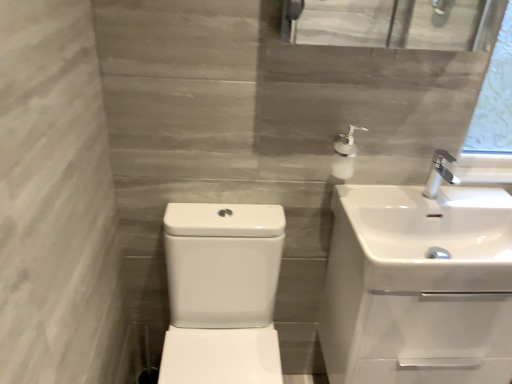
How much space does white glossy sink at right, which is counted as the second sink, starting from the left, occupy vertically?

20.98 inches.

You are a GUI agent. You are given a task and a screenshot of the screen. Output one action in this format:
    pyautogui.click(x=<x>, y=<y>)
    Task: Click on the white glossy sink at upper right, which ranks as the 3th sink in left-to-right order
    The width and height of the screenshot is (512, 384).
    Given the screenshot: What is the action you would take?
    pyautogui.click(x=430, y=221)

From the image's perspective, would you say white glossy soap dispenser at upper right is shown under white glossy sink at right, which is counted as the second sink, starting from the left?

No, from the image's perspective, white glossy soap dispenser at upper right is not beneath white glossy sink at right, which is counted as the second sink, starting from the left.

Does white glossy soap dispenser at upper right have a larger size compared to white glossy sink at right, which is counted as the second sink, starting from the left?

Actually, white glossy soap dispenser at upper right might be smaller than white glossy sink at right, which is counted as the second sink, starting from the left.

Is the position of white glossy soap dispenser at upper right less distant than that of white glossy sink at right, the second sink positioned from the right?

No, white glossy soap dispenser at upper right is behind white glossy sink at right, the second sink positioned from the right.

Is white glossy soap dispenser at upper right thinner than white glossy sink at right, which is counted as the second sink, starting from the left?

Indeed, white glossy soap dispenser at upper right has a lesser width compared to white glossy sink at right, which is counted as the second sink, starting from the left.

Considering the relative positions of white glossy sink at upper right, which is the 1th sink in right-to-left order, and white glossy sink at center, which is the third sink from right to left, in the image provided, is white glossy sink at upper right, which is the 1th sink in right-to-left order, to the right of white glossy sink at center, which is the third sink from right to left, from the viewer's perspective?

Correct, you'll find white glossy sink at upper right, which is the 1th sink in right-to-left order, to the right of white glossy sink at center, which is the third sink from right to left.

Can you tell me how much white glossy sink at upper right, which is the 1th sink in right-to-left order, and white glossy sink at center, which is counted as the first sink, starting from the left, differ in facing direction?

The facing directions of white glossy sink at upper right, which is the 1th sink in right-to-left order, and white glossy sink at center, which is counted as the first sink, starting from the left, are 0.44 degrees apart.

Considering the positions of points (399, 235) and (206, 371), is point (399, 235) closer to camera compared to point (206, 371)?

No, (399, 235) is further to viewer.

Is white glossy sink at upper right, which is the 1th sink in right-to-left order, looking in the opposite direction of white glossy sink at center, which is counted as the first sink, starting from the left?

No, white glossy sink at upper right, which is the 1th sink in right-to-left order, is not facing away from white glossy sink at center, which is counted as the first sink, starting from the left.

Is point (418, 217) farther from camera compared to point (336, 143)?

Yes, it is.

Would you say white glossy sink at right, which is counted as the second sink, starting from the left, is to the left or to the right of white glossy soap dispenser at upper right in the picture?

Clearly, white glossy sink at right, which is counted as the second sink, starting from the left, is on the right of white glossy soap dispenser at upper right in the image.

Considering the relative sizes of white glossy sink at right, which is counted as the second sink, starting from the left, and white glossy soap dispenser at upper right in the image provided, is white glossy sink at right, which is counted as the second sink, starting from the left, shorter than white glossy soap dispenser at upper right?

No.

You are a GUI agent. You are given a task and a screenshot of the screen. Output one action in this format:
    pyautogui.click(x=<x>, y=<y>)
    Task: Click on the sink that is the 1st one when counting forward from the white glossy soap dispenser at upper right
    
    Given the screenshot: What is the action you would take?
    pyautogui.click(x=419, y=283)

Based on the photo, which is closer, (352, 152) or (385, 215)?

Positioned in front is point (385, 215).

Is white glossy soap dispenser at upper right far from white glossy sink at upper right, which is the 1th sink in right-to-left order?

No, there isn't a large distance between white glossy soap dispenser at upper right and white glossy sink at upper right, which is the 1th sink in right-to-left order.

Based on the photo, from a real-world perspective, who is located lower, white glossy soap dispenser at upper right or white glossy sink at upper right, which is the 1th sink in right-to-left order?

white glossy sink at upper right, which is the 1th sink in right-to-left order, from a real-world perspective.

Is white glossy soap dispenser at upper right oriented towards white glossy sink at upper right, which ranks as the 3th sink in left-to-right order?

No, white glossy soap dispenser at upper right is not facing towards white glossy sink at upper right, which ranks as the 3th sink in left-to-right order.

Does point (186, 311) appear closer or farther from the camera than point (350, 149)?

Point (186, 311) is farther from the camera than point (350, 149).

Looking at this image, considering the relative sizes of white glossy sink at center, which is the third sink from right to left, and white glossy soap dispenser at upper right in the image provided, is white glossy sink at center, which is the third sink from right to left, shorter than white glossy soap dispenser at upper right?

No.

Is white glossy sink at center, which is the third sink from right to left, oriented towards white glossy soap dispenser at upper right?

No, white glossy sink at center, which is the third sink from right to left, does not turn towards white glossy soap dispenser at upper right.

Is white glossy sink at center, which is the third sink from right to left, next to white glossy soap dispenser at upper right and touching it?

There is a gap between white glossy sink at center, which is the third sink from right to left, and white glossy soap dispenser at upper right.

Consider the image. Would you say white glossy soap dispenser at upper right is to the left or to the right of white glossy sink at center, which is counted as the first sink, starting from the left, in the picture?

Clearly, white glossy soap dispenser at upper right is on the right of white glossy sink at center, which is counted as the first sink, starting from the left, in the image.

Is white glossy soap dispenser at upper right bigger than white glossy sink at center, which is the third sink from right to left?

Actually, white glossy soap dispenser at upper right might be smaller than white glossy sink at center, which is the third sink from right to left.

From the image's perspective, which one is positioned higher, white glossy soap dispenser at upper right or white glossy sink at center, which is the third sink from right to left?

white glossy soap dispenser at upper right is shown above in the image.

Could white glossy sink at center, which is counted as the first sink, starting from the left, be considered to be inside white glossy soap dispenser at upper right?

Definitely not — white glossy sink at center, which is counted as the first sink, starting from the left, is not inside white glossy soap dispenser at upper right.

Consider the image. Are white glossy sink at upper right, which ranks as the 3th sink in left-to-right order, and white glossy soap dispenser at upper right far apart?

No.

How distant is white glossy sink at upper right, which ranks as the 3th sink in left-to-right order, from white glossy soap dispenser at upper right?

white glossy sink at upper right, which ranks as the 3th sink in left-to-right order, is 10.52 inches from white glossy soap dispenser at upper right.

Who is bigger, white glossy sink at upper right, which ranks as the 3th sink in left-to-right order, or white glossy soap dispenser at upper right?

With larger size is white glossy sink at upper right, which ranks as the 3th sink in left-to-right order.

How many degrees apart are the facing directions of white glossy sink at upper right, which ranks as the 3th sink in left-to-right order, and white glossy soap dispenser at upper right?

white glossy sink at upper right, which ranks as the 3th sink in left-to-right order, and white glossy soap dispenser at upper right are facing 0.247 degrees away from each other.

You are a GUI agent. You are given a task and a screenshot of the screen. Output one action in this format:
    pyautogui.click(x=<x>, y=<y>)
    Task: Click on the soap dispenser to the left of white glossy sink at right, the second sink positioned from the right
    
    Given the screenshot: What is the action you would take?
    pyautogui.click(x=345, y=154)

This screenshot has width=512, height=384. Find the location of `the 2nd sink counting from the right side of the white glossy sink at center, which is the third sink from right to left`. the 2nd sink counting from the right side of the white glossy sink at center, which is the third sink from right to left is located at coordinates (430, 221).

Which object lies nearer to the anchor point white glossy sink at right, which is counted as the second sink, starting from the left, white glossy soap dispenser at upper right or white glossy sink at center, which is counted as the first sink, starting from the left?

white glossy sink at center, which is counted as the first sink, starting from the left, is positioned closer to the anchor white glossy sink at right, which is counted as the second sink, starting from the left.

Looking at the image, which one is located closer to white glossy sink at upper right, which is the 1th sink in right-to-left order, white glossy sink at right, the second sink positioned from the right, or white glossy soap dispenser at upper right?

The object closer to white glossy sink at upper right, which is the 1th sink in right-to-left order, is white glossy sink at right, the second sink positioned from the right.

Based on their spatial positions, is white glossy sink at right, which is counted as the second sink, starting from the left, or white glossy sink at center, which is the third sink from right to left, further from white glossy sink at upper right, which is the 1th sink in right-to-left order?

The object further to white glossy sink at upper right, which is the 1th sink in right-to-left order, is white glossy sink at center, which is the third sink from right to left.

Estimate the real-world distances between objects in this image. Which object is further from white glossy soap dispenser at upper right, white glossy sink at center, which is counted as the first sink, starting from the left, or white glossy sink at right, which is counted as the second sink, starting from the left?

white glossy sink at center, which is counted as the first sink, starting from the left.

Estimate the real-world distances between objects in this image. Which object is closer to white glossy sink at upper right, which is the 1th sink in right-to-left order, white glossy soap dispenser at upper right or white glossy sink at center, which is the third sink from right to left?

white glossy soap dispenser at upper right is closer to white glossy sink at upper right, which is the 1th sink in right-to-left order.

Estimate the real-world distances between objects in this image. Which object is further from white glossy sink at center, which is counted as the first sink, starting from the left, white glossy sink at right, the second sink positioned from the right, or white glossy sink at upper right, which ranks as the 3th sink in left-to-right order?

Among the two, white glossy sink at upper right, which ranks as the 3th sink in left-to-right order, is located further to white glossy sink at center, which is counted as the first sink, starting from the left.

Estimate the real-world distances between objects in this image. Which object is closer to white glossy sink at center, which is counted as the first sink, starting from the left, white glossy soap dispenser at upper right or white glossy sink at upper right, which ranks as the 3th sink in left-to-right order?

Among the two, white glossy sink at upper right, which ranks as the 3th sink in left-to-right order, is located nearer to white glossy sink at center, which is counted as the first sink, starting from the left.

Estimate the real-world distances between objects in this image. Which object is closer to white glossy sink at center, which is the third sink from right to left, white glossy sink at right, the second sink positioned from the right, or white glossy soap dispenser at upper right?

white glossy sink at right, the second sink positioned from the right.

This screenshot has width=512, height=384. What are the coordinates of `sink between white glossy soap dispenser at upper right and white glossy sink at right, which is counted as the second sink, starting from the left, in the vertical direction` in the screenshot? It's located at (430, 221).

The height and width of the screenshot is (384, 512). I want to click on sink between white glossy sink at center, which is the third sink from right to left, and white glossy sink at upper right, which ranks as the 3th sink in left-to-right order, so click(x=419, y=283).